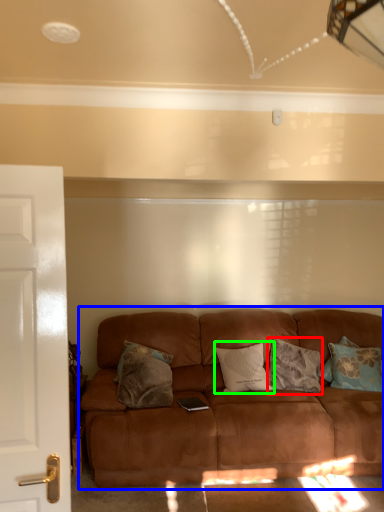
Question: Estimate the real-world distances between objects in this image. Which object is closer to pillow (highlighted by a red box), studio couch (highlighted by a blue box) or pillow (highlighted by a green box)?

Choices:
 (A) studio couch
 (B) pillow

Answer: (B)